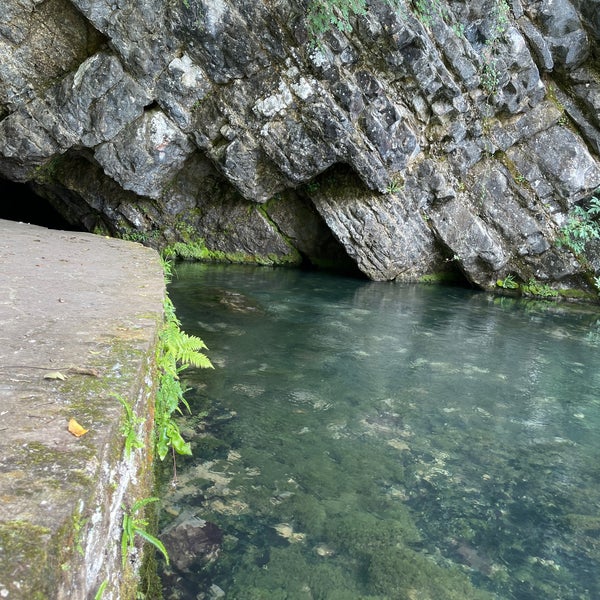
Find the location of a particular element. green plant life is located at coordinates (179, 346).